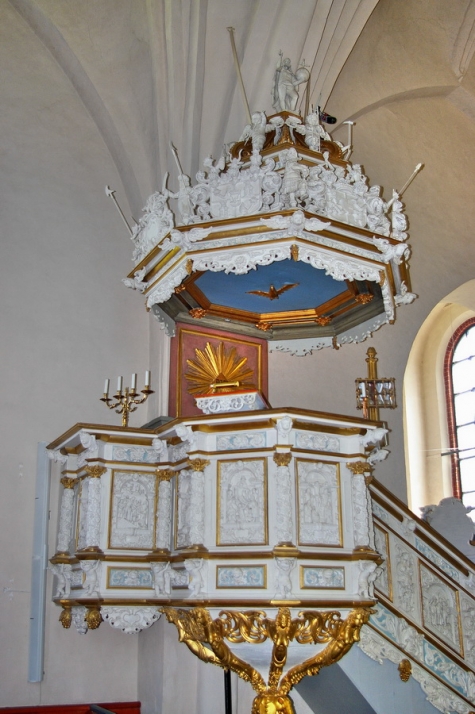
Find the location of a particular element. The height and width of the screenshot is (714, 475). white wall is located at coordinates (50, 350), (315, 373).